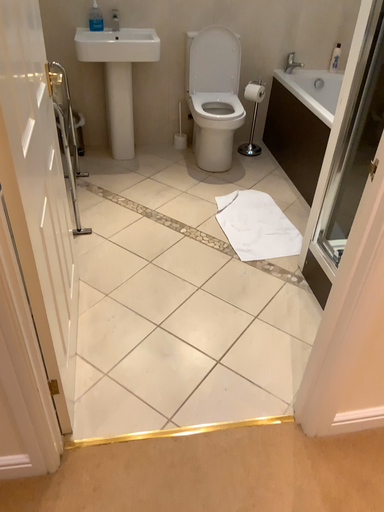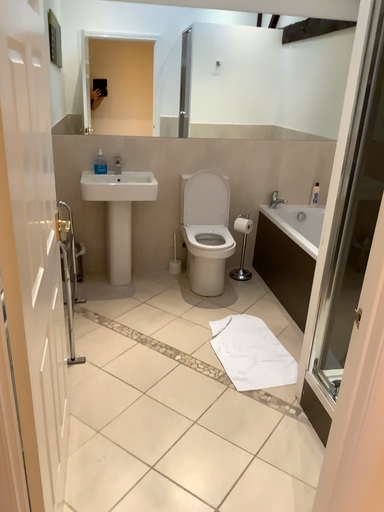
Question: Which way did the camera rotate in the video?

Choices:
 (A) rotated upward
 (B) rotated downward

Answer: (A)